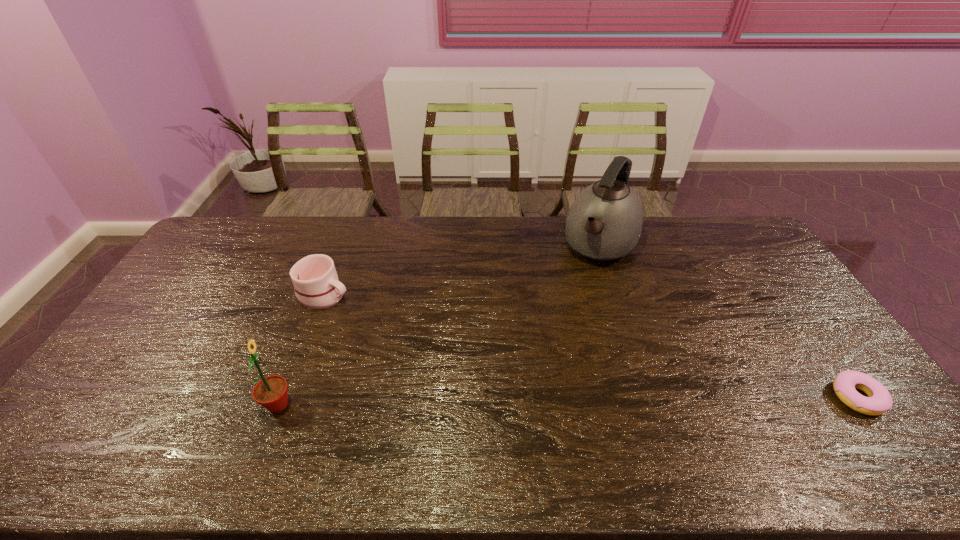
Locate an element on the screen. This screenshot has width=960, height=540. empty space that is in between the second shortest object and the tallest object is located at coordinates (463, 270).

The image size is (960, 540). In order to click on vacant space in between the kettle and the doughnut in this screenshot , I will do point(729,321).

At what (x,y) coordinates should I click in order to perform the action: click on vacant region between the third nearest object and the rightmost object. Please return your answer as a coordinate pair (x, y). The width and height of the screenshot is (960, 540). Looking at the image, I should click on (590, 346).

Locate an element on the screen. The height and width of the screenshot is (540, 960). unoccupied position between the tallest object and the second farthest object is located at coordinates (463, 270).

At what (x,y) coordinates should I click in order to perform the action: click on vacant space that's between the rightmost object and the third tallest object. Please return your answer as a coordinate pair (x, y). Looking at the image, I should click on (590, 346).

Identify which object is the nearest to the third tallest object. Please provide its 2D coordinates. Your answer should be formatted as a tuple, i.e. [(x, y)], where the tuple contains the x and y coordinates of a point satisfying the conditions above.

[(271, 392)]

You are a GUI agent. You are given a task and a screenshot of the screen. Output one action in this format:
    pyautogui.click(x=<x>, y=<y>)
    Task: Click on the object identified as the second closest to the second tallest object
    This screenshot has height=540, width=960.
    Given the screenshot: What is the action you would take?
    pyautogui.click(x=604, y=223)

In order to click on vacant point that satisfies the following two spatial constraints: 1. on the front side of the kettle; 2. on the right side of the rightmost object in this screenshot , I will do tap(650, 397).

This screenshot has width=960, height=540. Find the location of `vacant space that satisfies the following two spatial constraints: 1. on the front side of the tallest object; 2. on the right side of the rightmost object`. vacant space that satisfies the following two spatial constraints: 1. on the front side of the tallest object; 2. on the right side of the rightmost object is located at coordinates 650,397.